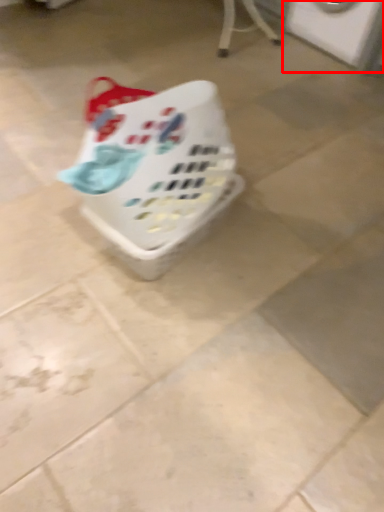
Question: From the image, what is the correct spatial relationship of washing machine (annotated by the red box) in relation to basket?

Choices:
 (A) right
 (B) left

Answer: (A)